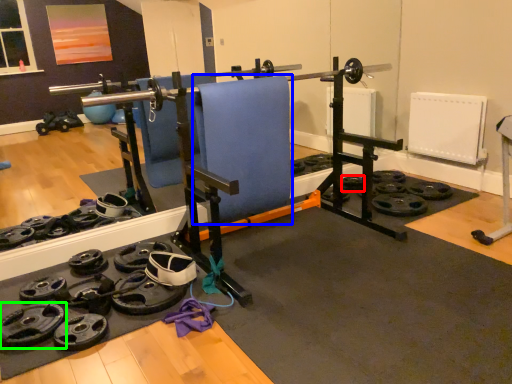
Question: Based on their relative distances, which object is nearer to wheel (highlighted by a red box)? Choose from swivel chair (highlighted by a blue box) and wheel (highlighted by a green box).

Choices:
 (A) swivel chair
 (B) wheel

Answer: (A)